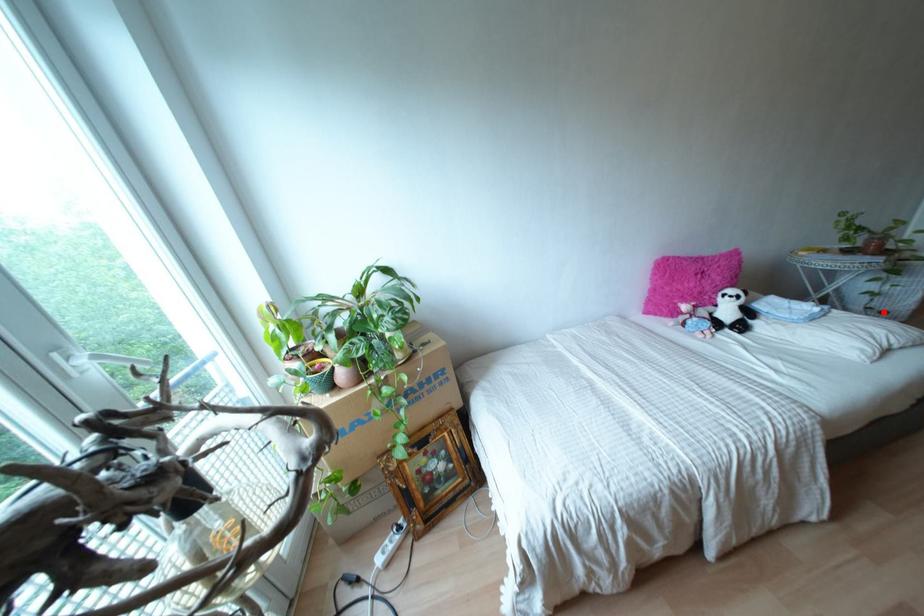
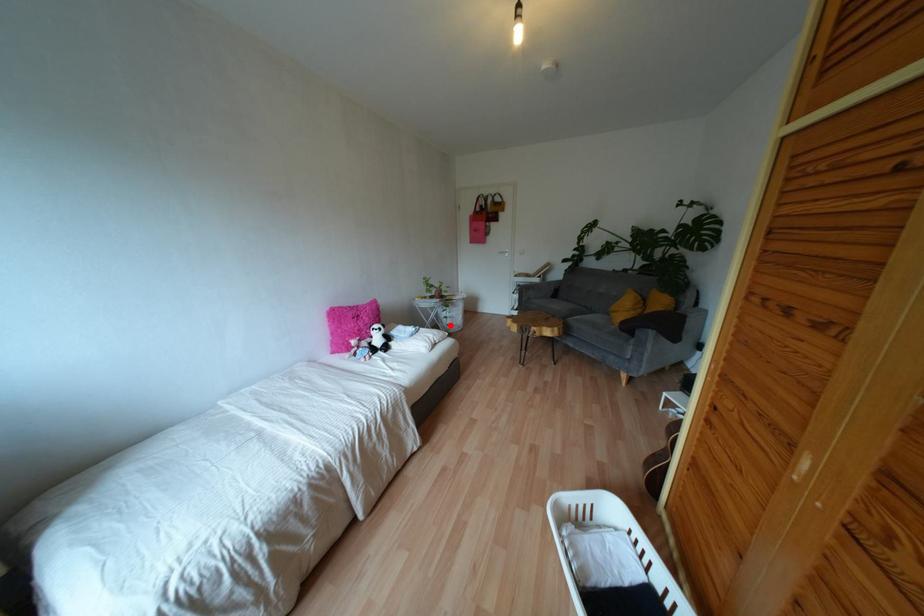
I am providing you with two images of the same scene from different viewpoints. A red point is marked on the first image and another point is marked on the second image. Are the points marked in image1 and image2 representing the same 3D position?

Yes